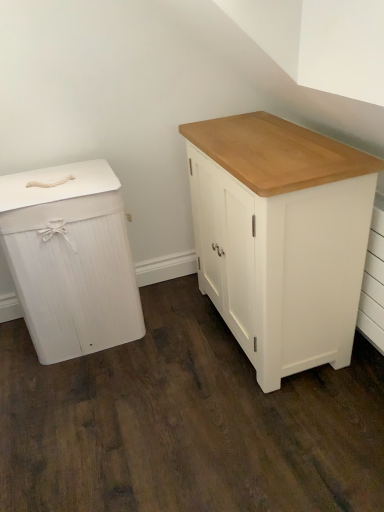
The image size is (384, 512). Describe the element at coordinates (281, 237) in the screenshot. I see `white painted wood cabinet at center, the first chest of drawers viewed from the right` at that location.

This screenshot has height=512, width=384. In order to click on white painted wood cabinet at center, which is the 2th chest of drawers from left to right in this screenshot , I will do `click(281, 237)`.

Locate an element on the screen. white wood chest of drawers at left, the first chest of drawers positioned from the left is located at coordinates (71, 260).

What do you see at coordinates (71, 260) in the screenshot? I see `white wood chest of drawers at left, the first chest of drawers positioned from the left` at bounding box center [71, 260].

How much space does white wood chest of drawers at left, the first chest of drawers positioned from the left, occupy vertically?

It is 26.58 inches.

Locate an element on the screen. white painted wood cabinet at center, which is the 2th chest of drawers from left to right is located at coordinates [x=281, y=237].

Is white painted wood cabinet at center, which is the 2th chest of drawers from left to right, to the left or to the right of white wood chest of drawers at left, which is the second chest of drawers in right-to-left order, in the image?

white painted wood cabinet at center, which is the 2th chest of drawers from left to right, is to the right of white wood chest of drawers at left, which is the second chest of drawers in right-to-left order.

Which object is further away from the camera taking this photo, white painted wood cabinet at center, which is the 2th chest of drawers from left to right, or white wood chest of drawers at left, which is the second chest of drawers in right-to-left order?

white wood chest of drawers at left, which is the second chest of drawers in right-to-left order, is further from the camera.

Considering the positions of points (357, 258) and (90, 211), is point (357, 258) closer to camera compared to point (90, 211)?

That is True.

From the image's perspective, which one is positioned lower, white painted wood cabinet at center, the first chest of drawers viewed from the right, or white wood chest of drawers at left, which is the second chest of drawers in right-to-left order?

white wood chest of drawers at left, which is the second chest of drawers in right-to-left order, from the image's perspective.

From a real-world perspective, is white painted wood cabinet at center, which is the 2th chest of drawers from left to right, located beneath white wood chest of drawers at left, which is the second chest of drawers in right-to-left order?

No, from a real-world perspective, white painted wood cabinet at center, which is the 2th chest of drawers from left to right, is not under white wood chest of drawers at left, which is the second chest of drawers in right-to-left order.

Considering the sizes of white painted wood cabinet at center, the first chest of drawers viewed from the right, and white wood chest of drawers at left, the first chest of drawers positioned from the left, in the image, is white painted wood cabinet at center, the first chest of drawers viewed from the right, wider or thinner than white wood chest of drawers at left, the first chest of drawers positioned from the left,?

Considering their sizes, white painted wood cabinet at center, the first chest of drawers viewed from the right, looks slimmer than white wood chest of drawers at left, the first chest of drawers positioned from the left.

Who is shorter, white painted wood cabinet at center, the first chest of drawers viewed from the right, or white wood chest of drawers at left, which is the second chest of drawers in right-to-left order?

With less height is white wood chest of drawers at left, which is the second chest of drawers in right-to-left order.

Is white painted wood cabinet at center, the first chest of drawers viewed from the right, bigger than white wood chest of drawers at left, the first chest of drawers positioned from the left?

Correct, white painted wood cabinet at center, the first chest of drawers viewed from the right, is larger in size than white wood chest of drawers at left, the first chest of drawers positioned from the left.

Does white painted wood cabinet at center, which is the 2th chest of drawers from left to right, contain white wood chest of drawers at left, the first chest of drawers positioned from the left?

No, white wood chest of drawers at left, the first chest of drawers positioned from the left, is not surrounded by white painted wood cabinet at center, which is the 2th chest of drawers from left to right.

Is the surface of white painted wood cabinet at center, which is the 2th chest of drawers from left to right, in direct contact with white wood chest of drawers at left, which is the second chest of drawers in right-to-left order?

No, white painted wood cabinet at center, which is the 2th chest of drawers from left to right, is not making contact with white wood chest of drawers at left, which is the second chest of drawers in right-to-left order.

Is white painted wood cabinet at center, the first chest of drawers viewed from the right, facing away from white wood chest of drawers at left, the first chest of drawers positioned from the left?

No.

Measure the distance from white painted wood cabinet at center, which is the 2th chest of drawers from left to right, to white wood chest of drawers at left, which is the second chest of drawers in right-to-left order.

A distance of 20.22 inches exists between white painted wood cabinet at center, which is the 2th chest of drawers from left to right, and white wood chest of drawers at left, which is the second chest of drawers in right-to-left order.

Locate an element on the screen. Image resolution: width=384 pixels, height=512 pixels. chest of drawers in front of the white wood chest of drawers at left, which is the second chest of drawers in right-to-left order is located at coordinates (281, 237).

Considering the positions of objects white wood chest of drawers at left, which is the second chest of drawers in right-to-left order, and white painted wood cabinet at center, which is the 2th chest of drawers from left to right, in the image provided, who is more to the left, white wood chest of drawers at left, which is the second chest of drawers in right-to-left order, or white painted wood cabinet at center, which is the 2th chest of drawers from left to right,?

Positioned to the left is white wood chest of drawers at left, which is the second chest of drawers in right-to-left order.

Does white wood chest of drawers at left, the first chest of drawers positioned from the left, come behind white painted wood cabinet at center, the first chest of drawers viewed from the right?

Yes, white wood chest of drawers at left, the first chest of drawers positioned from the left, is further from the camera.

Which is in front, point (54, 257) or point (311, 178)?

Positioned in front is point (311, 178).

From the image's perspective, does white wood chest of drawers at left, the first chest of drawers positioned from the left, appear higher than white painted wood cabinet at center, which is the 2th chest of drawers from left to right?

No, from the image's perspective, white wood chest of drawers at left, the first chest of drawers positioned from the left, is not over white painted wood cabinet at center, which is the 2th chest of drawers from left to right.

From a real-world perspective, is white wood chest of drawers at left, which is the second chest of drawers in right-to-left order, on white painted wood cabinet at center, which is the 2th chest of drawers from left to right?

No, from a real-world perspective, white wood chest of drawers at left, which is the second chest of drawers in right-to-left order, is not on top of white painted wood cabinet at center, which is the 2th chest of drawers from left to right.

Does white wood chest of drawers at left, the first chest of drawers positioned from the left, have a greater width compared to white painted wood cabinet at center, the first chest of drawers viewed from the right?

Correct, the width of white wood chest of drawers at left, the first chest of drawers positioned from the left, exceeds that of white painted wood cabinet at center, the first chest of drawers viewed from the right.

Considering the sizes of objects white wood chest of drawers at left, the first chest of drawers positioned from the left, and white painted wood cabinet at center, the first chest of drawers viewed from the right, in the image provided, who is taller, white wood chest of drawers at left, the first chest of drawers positioned from the left, or white painted wood cabinet at center, the first chest of drawers viewed from the right,?

white painted wood cabinet at center, the first chest of drawers viewed from the right, is taller.

Which of these two, white wood chest of drawers at left, the first chest of drawers positioned from the left, or white painted wood cabinet at center, which is the 2th chest of drawers from left to right, is smaller?

Smaller between the two is white wood chest of drawers at left, the first chest of drawers positioned from the left.

Is white wood chest of drawers at left, the first chest of drawers positioned from the left, completely or partially outside of white painted wood cabinet at center, which is the 2th chest of drawers from left to right?

Yes, white wood chest of drawers at left, the first chest of drawers positioned from the left, is located beyond the bounds of white painted wood cabinet at center, which is the 2th chest of drawers from left to right.

Is white wood chest of drawers at left, which is the second chest of drawers in right-to-left order, not near white painted wood cabinet at center, the first chest of drawers viewed from the right?

No, white wood chest of drawers at left, which is the second chest of drawers in right-to-left order, is in close proximity to white painted wood cabinet at center, the first chest of drawers viewed from the right.

Could you tell me if white wood chest of drawers at left, the first chest of drawers positioned from the left, is turned towards white painted wood cabinet at center, which is the 2th chest of drawers from left to right?

No, white wood chest of drawers at left, the first chest of drawers positioned from the left, is not turned towards white painted wood cabinet at center, which is the 2th chest of drawers from left to right.

How many degrees apart are the facing directions of white wood chest of drawers at left, which is the second chest of drawers in right-to-left order, and white painted wood cabinet at center, which is the 2th chest of drawers from left to right?

The facing directions of white wood chest of drawers at left, which is the second chest of drawers in right-to-left order, and white painted wood cabinet at center, which is the 2th chest of drawers from left to right, are 90.5 degrees apart.

At what (x,y) coordinates should I click in order to perform the action: click on chest of drawers above the white wood chest of drawers at left, which is the second chest of drawers in right-to-left order (from a real-world perspective). Please return your answer as a coordinate pair (x, y). This screenshot has height=512, width=384. Looking at the image, I should click on (281, 237).

In order to click on chest of drawers above the white wood chest of drawers at left, the first chest of drawers positioned from the left (from the image's perspective) in this screenshot , I will do `click(281, 237)`.

This screenshot has height=512, width=384. In order to click on chest of drawers below the white painted wood cabinet at center, the first chest of drawers viewed from the right (from the image's perspective) in this screenshot , I will do `click(71, 260)`.